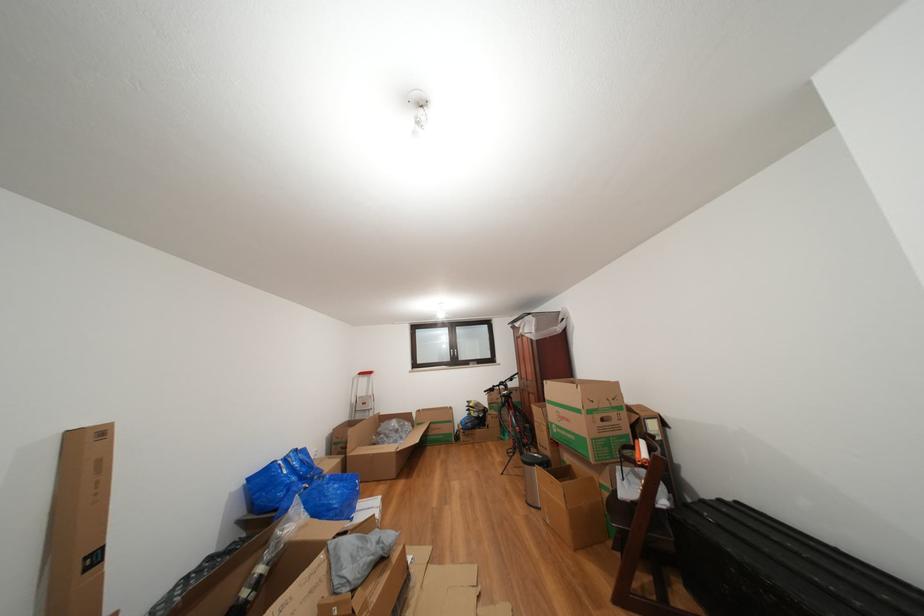
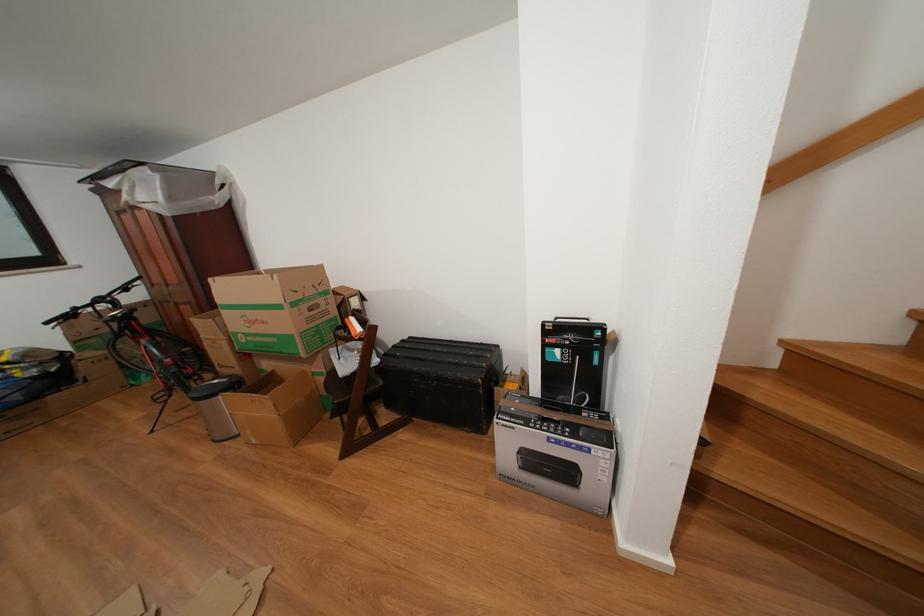
In the second image, find the point that corresponds to point 633,508 in the first image.

(354, 383)